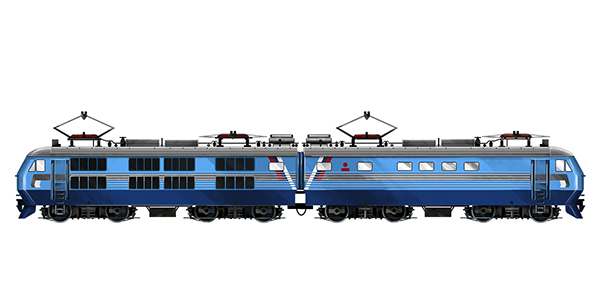
This screenshot has width=600, height=300. I want to click on window, so click(367, 164).